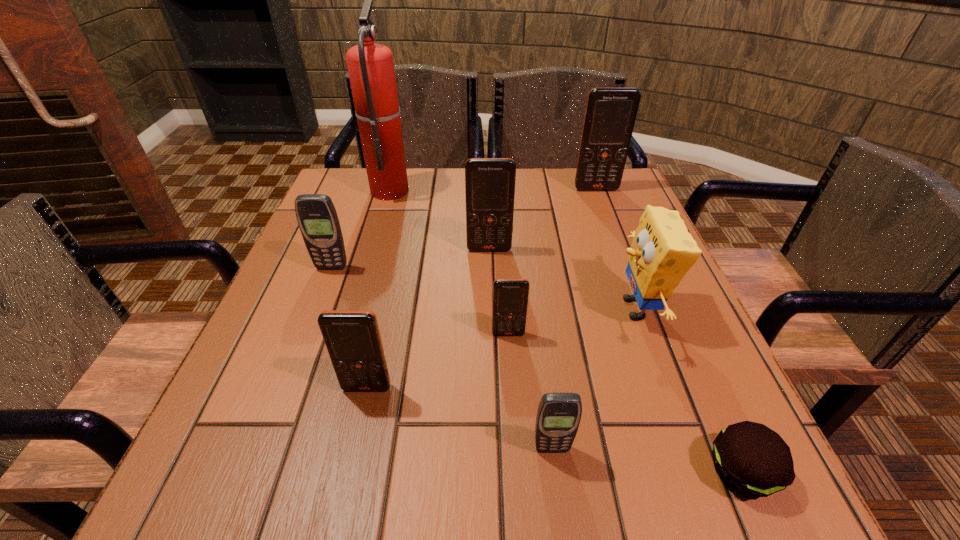
Where is `vacant point located between the red fire extinguisher and the smaller gray cellular telephone`? This screenshot has width=960, height=540. vacant point located between the red fire extinguisher and the smaller gray cellular telephone is located at coordinates (471, 319).

This screenshot has height=540, width=960. Identify the location of the second closest object to the patty. (558, 417).

The height and width of the screenshot is (540, 960). Identify the location of object that stands as the fifth closest to the yellow sponge. tap(610, 115).

Identify which cellular telephone is the second nearest to the fifth farthest cellular telephone. Please provide its 2D coordinates. Your answer should be formatted as a tuple, i.e. [(x, y)], where the tuple contains the x and y coordinates of a point satisfying the conditions above.

[(558, 417)]

Find the location of a particular element. the third closest cellular telephone to the leftmost orange cellular telephone is located at coordinates (317, 218).

This screenshot has width=960, height=540. I want to click on orange cellular telephone that stands as the second closest to the farther gray cellular telephone, so click(352, 337).

Locate which orange cellular telephone ranks in proximity to the sponge. Please provide its 2D coordinates. Your answer should be formatted as a tuple, i.e. [(x, y)], where the tuple contains the x and y coordinates of a point satisfying the conditions above.

[(510, 296)]

At what (x,y) coordinates should I click in order to perform the action: click on free location that satisfies the following two spatial constraints: 1. on the screen of the rightmost cellular telephone; 2. on the face of the yellow sponge. Please return your answer as a coordinate pair (x, y). Image resolution: width=960 pixels, height=540 pixels. Looking at the image, I should click on (641, 308).

Where is `vacant space that satisfies the following two spatial constraints: 1. on the screen of the nearest cellular telephone; 2. on the left side of the patty`? vacant space that satisfies the following two spatial constraints: 1. on the screen of the nearest cellular telephone; 2. on the left side of the patty is located at coordinates (555, 471).

Identify the location of free space that satisfies the following two spatial constraints: 1. on the face of the shortest object; 2. on the left side of the yellow sponge. (694, 471).